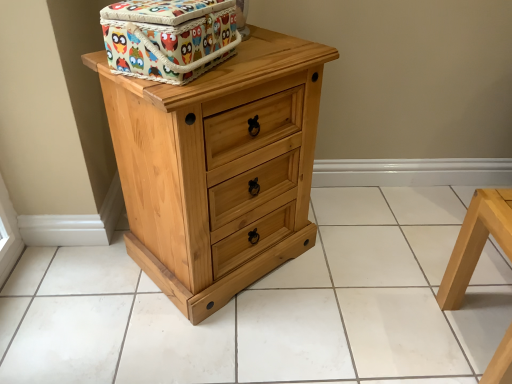
What are the coordinates of `free space in front of natural wood chest of drawers at center` in the screenshot? It's located at (217, 340).